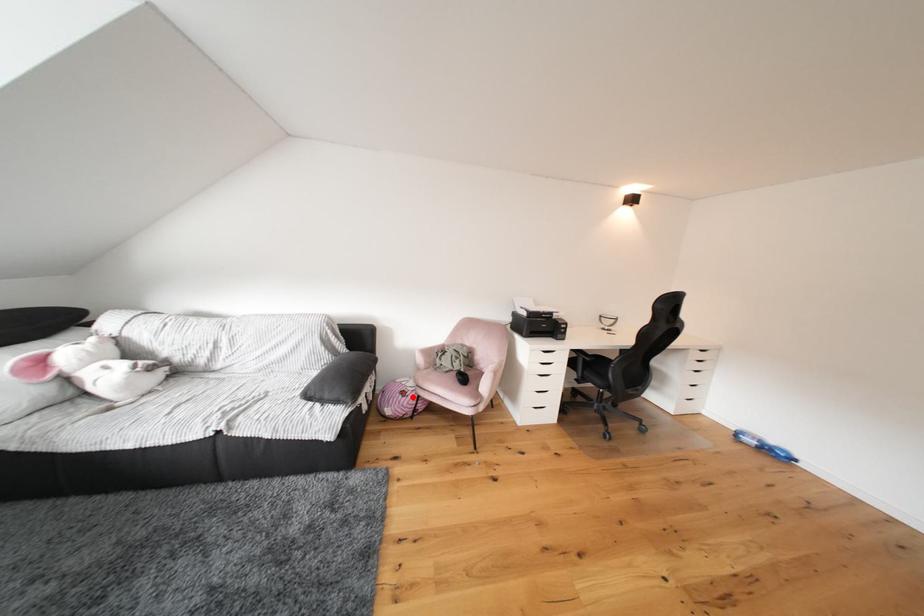
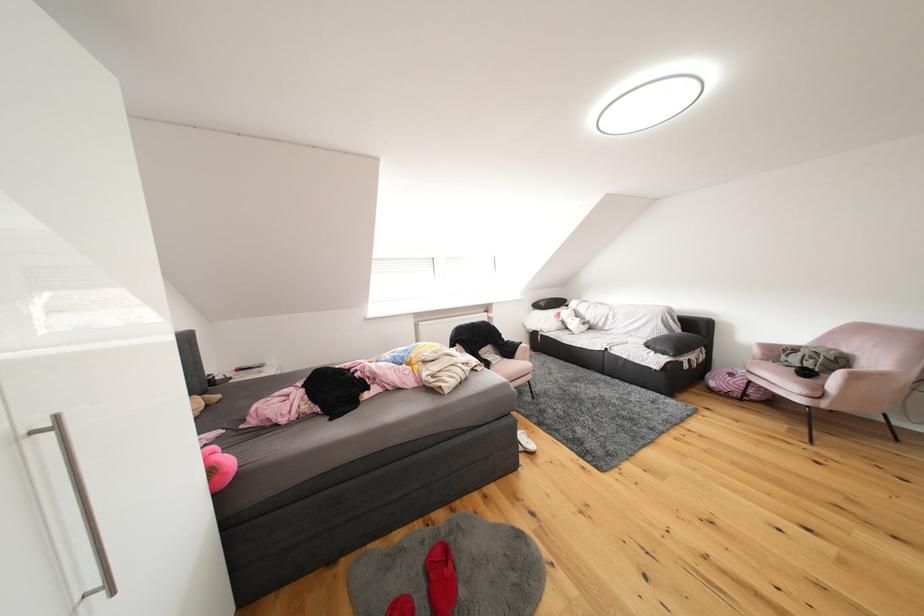
Question: A red point is marked in image1. In image2, is the corresponding 3D point closer to the camera or farther? Reply with the corresponding letter.

Choices:
 (A) The corresponding 3D point is closer.
 (B) The corresponding 3D point is farther.

Answer: (A)